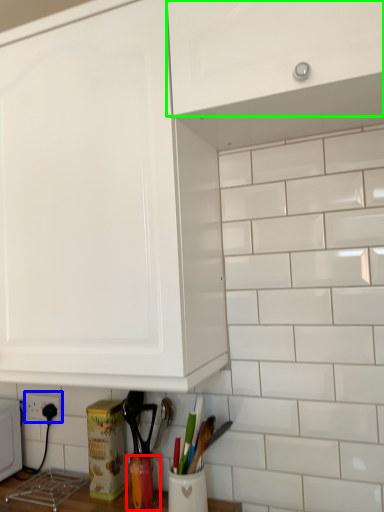
Question: Considering the real-world distances, which object is closest to appliance (highlighted by a red box)? electric outlet (highlighted by a blue box) or cabinetry (highlighted by a green box).

Choices:
 (A) electric outlet
 (B) cabinetry

Answer: (A)